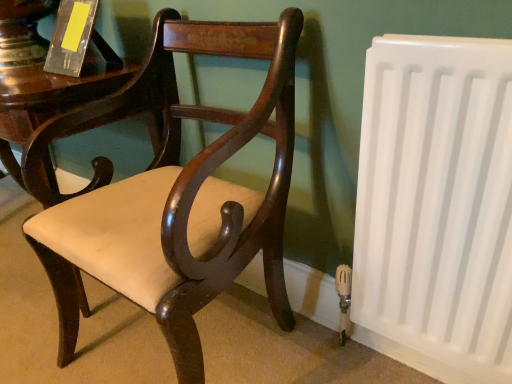
Question: Is translucent acrylic book at upper left smaller than matte wood chair at center?

Choices:
 (A) yes
 (B) no

Answer: (A)

Question: From the image's perspective, would you say translucent acrylic book at upper left is shown under matte wood chair at center?

Choices:
 (A) yes
 (B) no

Answer: (B)

Question: Is translucent acrylic book at upper left far from matte wood chair at center?

Choices:
 (A) no
 (B) yes

Answer: (A)

Question: Is matte wood chair at center a part of translucent acrylic book at upper left?

Choices:
 (A) no
 (B) yes

Answer: (A)

Question: From the image's perspective, is translucent acrylic book at upper left over matte wood chair at center?

Choices:
 (A) no
 (B) yes

Answer: (B)

Question: From a real-world perspective, is translucent acrylic book at upper left physically above matte wood chair at center?

Choices:
 (A) yes
 (B) no

Answer: (A)

Question: From the image's perspective, is matte wood chair at center beneath white plastic radiator at right?

Choices:
 (A) no
 (B) yes

Answer: (A)

Question: Is there a large distance between matte wood chair at center and white plastic radiator at right?

Choices:
 (A) no
 (B) yes

Answer: (A)

Question: Can you confirm if matte wood chair at center is thinner than white plastic radiator at right?

Choices:
 (A) yes
 (B) no

Answer: (B)

Question: Can you confirm if matte wood chair at center is shorter than white plastic radiator at right?

Choices:
 (A) yes
 (B) no

Answer: (B)

Question: Considering the relative sizes of matte wood chair at center and white plastic radiator at right in the image provided, is matte wood chair at center smaller than white plastic radiator at right?

Choices:
 (A) yes
 (B) no

Answer: (B)

Question: Could you tell me if matte wood chair at center is facing white plastic radiator at right?

Choices:
 (A) no
 (B) yes

Answer: (A)

Question: Is white plastic radiator at right far away from matte wood chair at center?

Choices:
 (A) no
 (B) yes

Answer: (A)